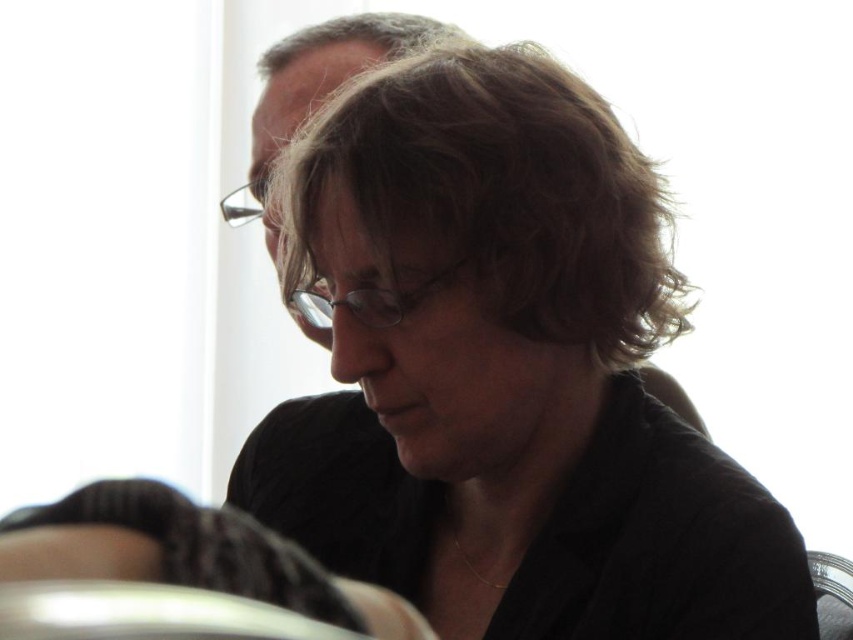
You are a photographer adjusting the focus of a camera. The camera has a focus point at coordinates 0.306, 0.581. Which object in the scene should you focus on to capture the brown matte hair at center clearly?

The brown matte hair at center is located at the coordinates (495, 195), so you should focus on the brown matte hair at center to capture it clearly.

You are a photographer trying to capture a closeup of the clear plastic glasses at upper center without including the brown matte hair at center in the frame. Is this possible given their current positions?

The brown matte hair at center is much taller than the clear plastic glasses at upper center, so the hair may block the glasses from view. It might be challenging to capture the glasses without the hair being in the frame unless you adjust the angle or move closer.

You are at a table with two sets of clear plastic glasses. The clear plastic glasses at center and the clear plastic glasses at upper center. Which set has taller glasses?

The clear plastic glasses at upper center are taller than the clear plastic glasses at center.